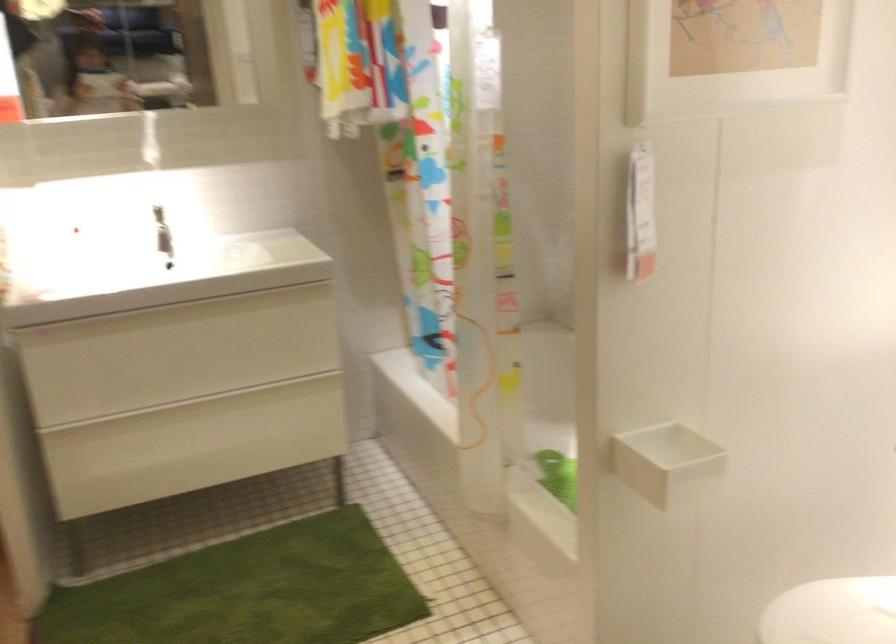
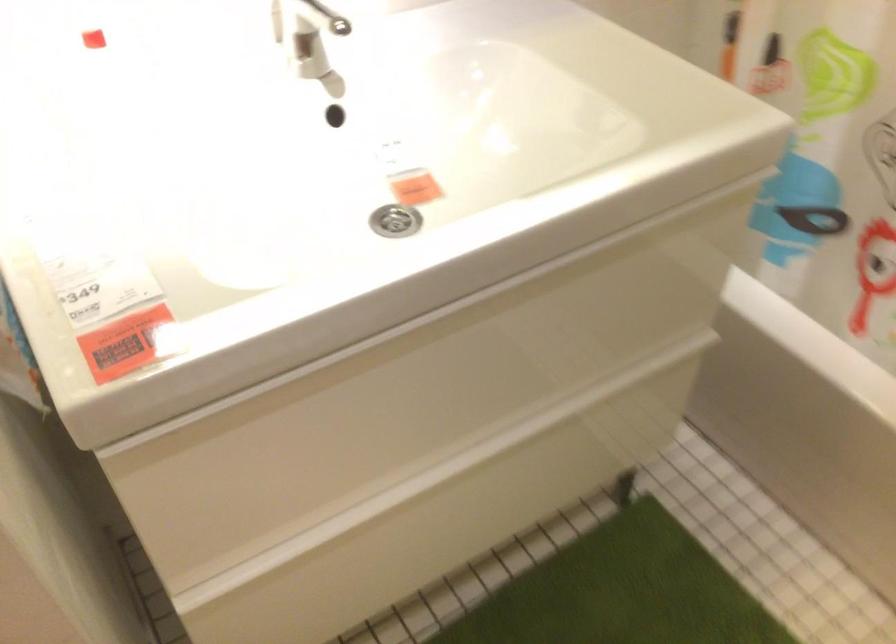
Find the pixel in the second image that matches pixel 88 228 in the first image.

(92, 39)